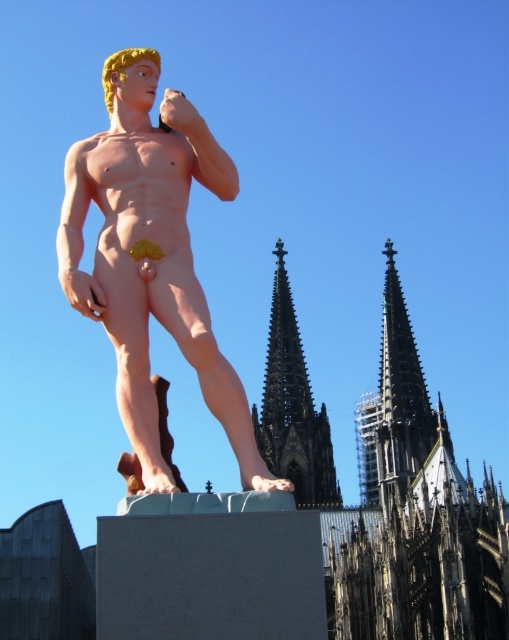
Is dark gray stone spire at upper right bigger than dark gray stone spire at upper center?

Correct, dark gray stone spire at upper right is larger in size than dark gray stone spire at upper center.

This screenshot has height=640, width=509. What are the coordinates of `dark gray stone spire at upper right` in the screenshot? It's located at (395, 404).

Does pink matte statue at center have a greater height compared to dark gray stone spire at upper center?

Yes.

Is point (112, 164) positioned in front of point (253, 413)?

Yes.

This screenshot has height=640, width=509. In order to click on pink matte statue at center in this screenshot , I will do `click(152, 257)`.

Between pink matte statue at center and dark gray stone spire at upper right, which one appears on the left side from the viewer's perspective?

Positioned to the left is pink matte statue at center.

Can you confirm if pink matte statue at center is wider than dark gray stone spire at upper right?

Indeed, pink matte statue at center has a greater width compared to dark gray stone spire at upper right.

Is point (91, 285) closer to camera compared to point (402, 440)?

That is True.

Find the location of `pink matte statue at center`. pink matte statue at center is located at coordinates (152, 257).